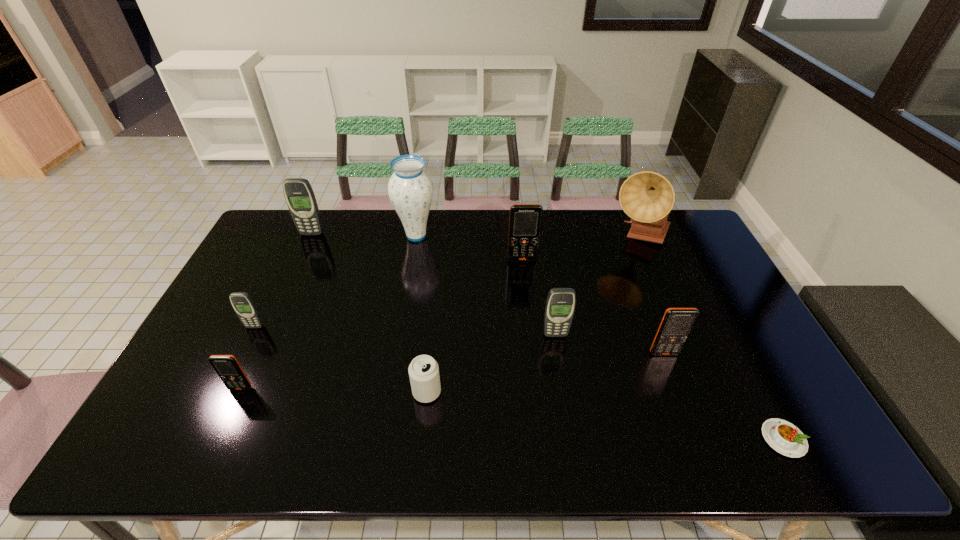
I want to click on object identified as the eighth closest to the second smallest gray cellular telephone, so click(x=244, y=306).

Locate which object ranks fourth in proximity to the sixth nearest object. Please provide its 2D coordinates. Your answer should be formatted as a tuple, i.e. [(x, y)], where the tuple contains the x and y coordinates of a point satisfying the conditions above.

[(424, 376)]

Image resolution: width=960 pixels, height=540 pixels. I want to click on cellular telephone object that ranks as the third closest to the farthest orange cellular telephone, so tap(299, 195).

Where is `the second closest cellular telephone relative to the biggest gray cellular telephone`? The image size is (960, 540). the second closest cellular telephone relative to the biggest gray cellular telephone is located at coordinates (227, 367).

Identify the location of the third closest orange cellular telephone to the farthest cellular telephone. (677, 323).

Where is `the second closest orange cellular telephone to the phonograph record`? This screenshot has height=540, width=960. the second closest orange cellular telephone to the phonograph record is located at coordinates point(677,323).

Locate which gray cellular telephone ranks third in proximity to the blue vase. Please provide its 2D coordinates. Your answer should be formatted as a tuple, i.e. [(x, y)], where the tuple contains the x and y coordinates of a point satisfying the conditions above.

[(560, 304)]

At what (x,y) coordinates should I click in order to perform the action: click on the second closest gray cellular telephone to the sixth farthest object. Please return your answer as a coordinate pair (x, y). Image resolution: width=960 pixels, height=540 pixels. Looking at the image, I should click on (299, 195).